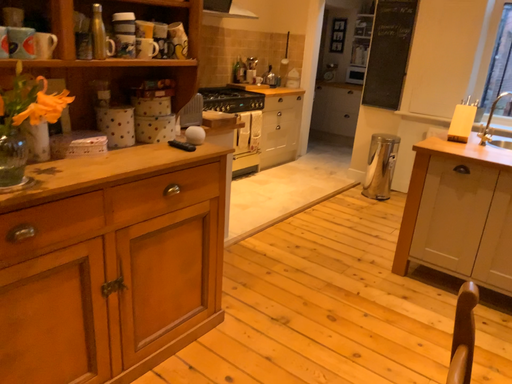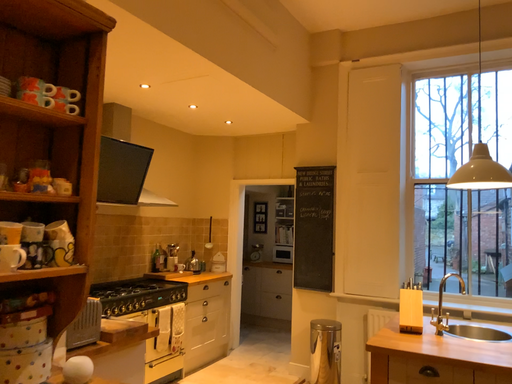
Question: How did the camera likely rotate when shooting the video?

Choices:
 (A) rotated left
 (B) rotated right

Answer: (B)